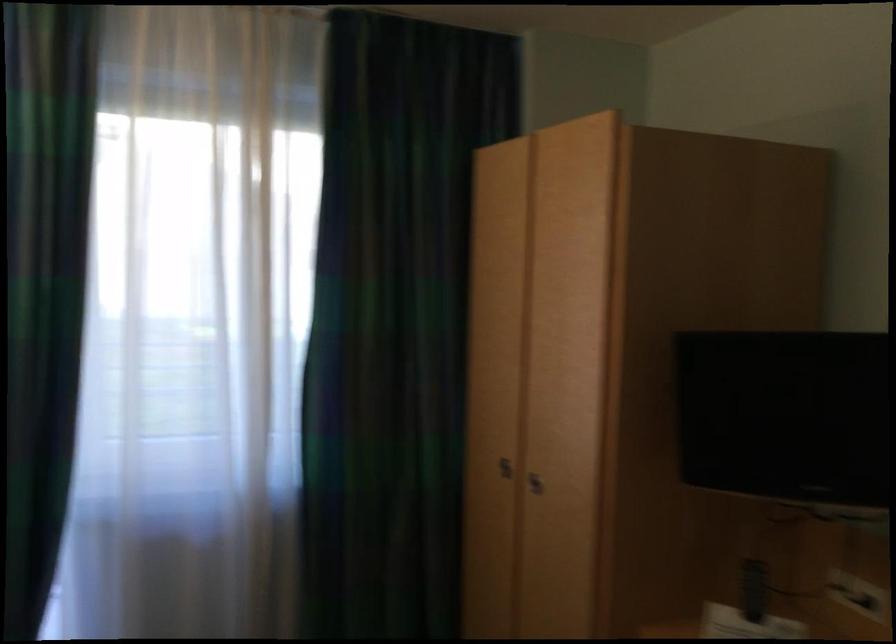
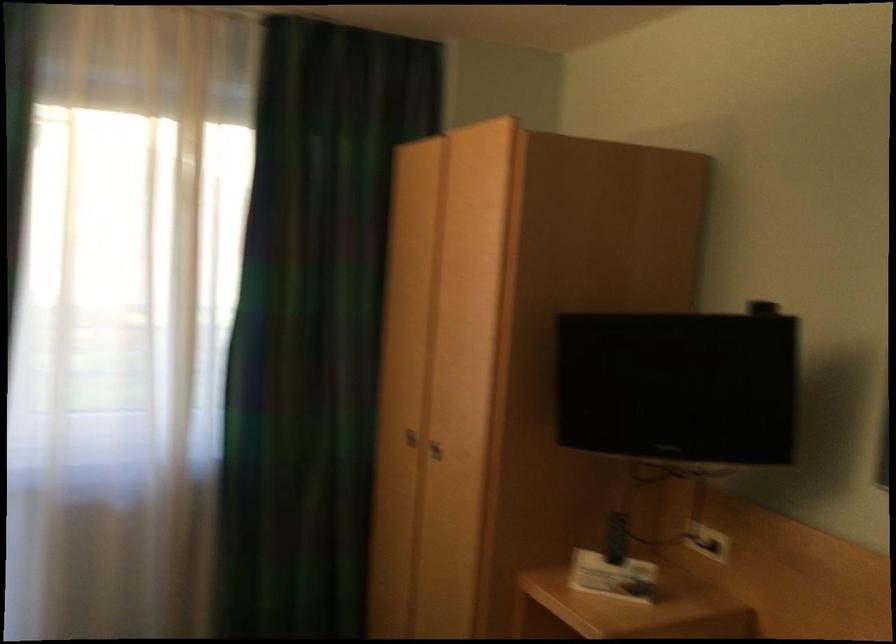
Where in the second image is the point corresponding to (531,480) from the first image?

(435, 450)